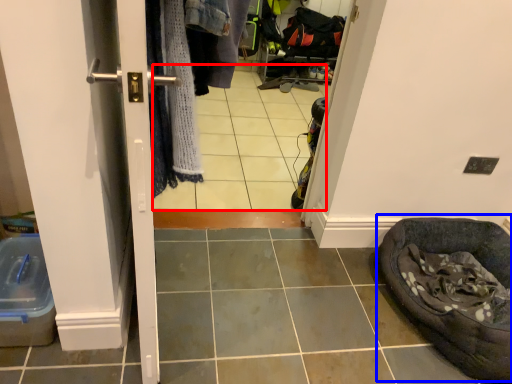
Question: Which object appears closest to the camera in this image, tile (highlighted by a red box) or bean bag chair (highlighted by a blue box)?

Choices:
 (A) tile
 (B) bean bag chair

Answer: (A)